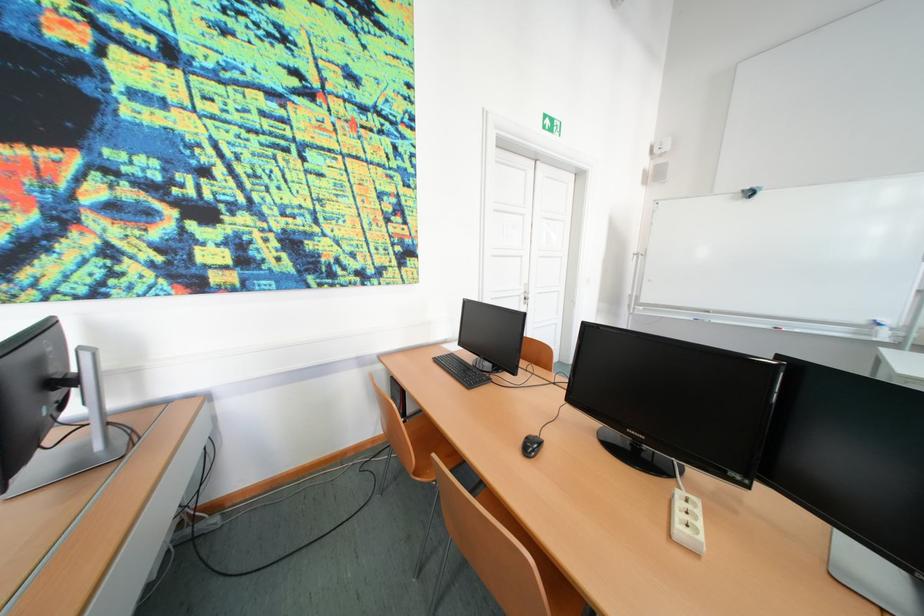
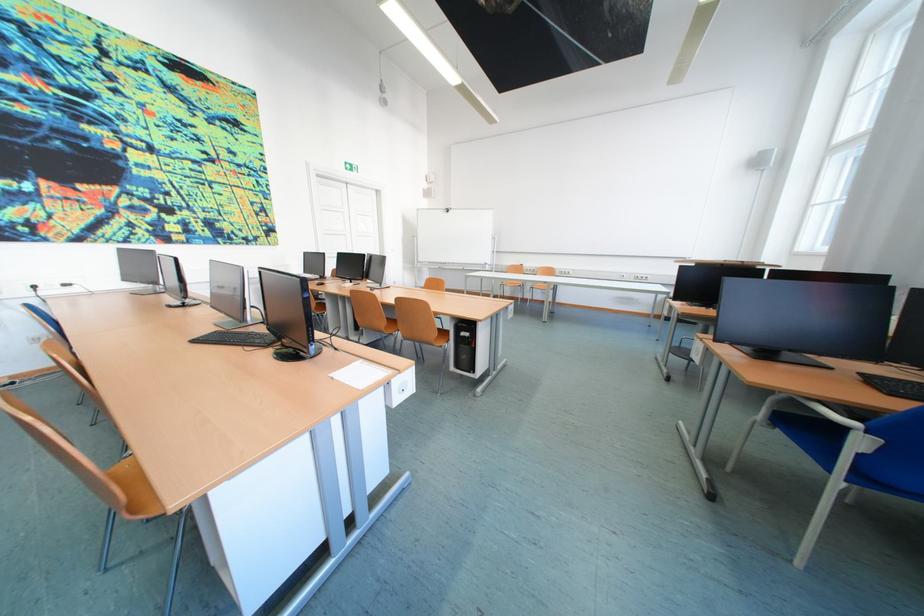
Question: Which direction would the cameraman need to move to produce the second image? Reply with the corresponding letter.

Choices:
 (A) Left
 (B) Right
 (C) Forward
 (D) Backward

Answer: (D)